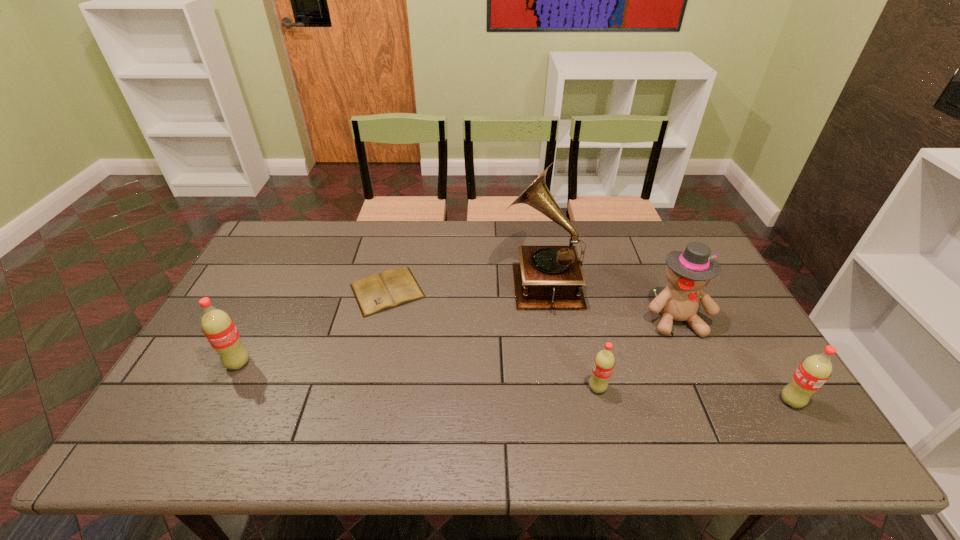
You are a GUI agent. You are given a task and a screenshot of the screen. Output one action in this format:
    pyautogui.click(x=<x>, y=<y>)
    Task: Click on the vacant space that is in between the record player and the second soda from right to left
    The width and height of the screenshot is (960, 540).
    Given the screenshot: What is the action you would take?
    pyautogui.click(x=569, y=335)

Find the location of a particular element. The height and width of the screenshot is (540, 960). vacant point located between the shortest object and the rightmost soda is located at coordinates (589, 346).

The image size is (960, 540). Find the location of `vacant space in between the rightmost object and the farthest soda`. vacant space in between the rightmost object and the farthest soda is located at coordinates (515, 382).

Image resolution: width=960 pixels, height=540 pixels. In order to click on free spot between the shortest object and the record player in this screenshot , I will do `click(464, 286)`.

Identify the location of free point between the farthest soda and the second shortest object. (418, 375).

This screenshot has width=960, height=540. I want to click on vacant space that is in between the fourth tallest object and the fourth farthest object, so click(515, 382).

Where is `unoccupied area between the shortest soda and the shortest object`? This screenshot has width=960, height=540. unoccupied area between the shortest soda and the shortest object is located at coordinates (492, 339).

I want to click on vacant area that lies between the shortest object and the tallest object, so click(x=464, y=286).

Point out which object is positioned as the second nearest to the fifth object from right to left. Please provide its 2D coordinates. Your answer should be formatted as a tuple, i.e. [(x, y)], where the tuple contains the x and y coordinates of a point satisfying the conditions above.

[(548, 277)]

In order to click on the fifth closest object to the farthest soda in this screenshot , I will do `click(815, 370)`.